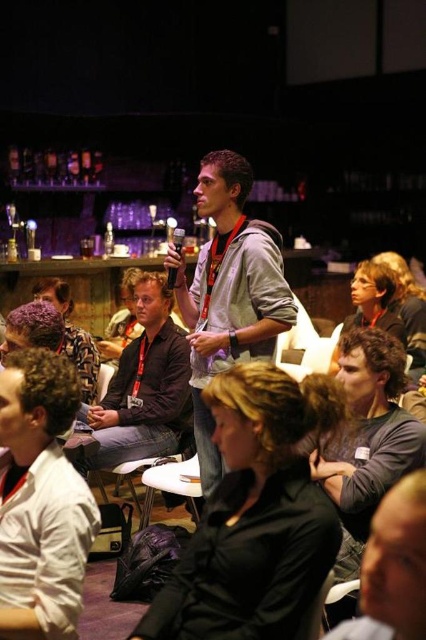
You are a photographer trying to capture a clear shot of both dark brown hair at lower left and dark brown hair at center during the presentation. Which hair should you focus on first to ensure it is in frame?

The dark brown hair at lower left is larger in size than dark brown hair at center, so you should focus on the dark brown hair at lower left first to ensure it is in frame.

You are a photographer positioned at the back of the room. You need to take a photo of both the white cotton shirt at lower left and the dark gray hoodie at center. Which person should you focus on first to ensure both are in the frame?

You should focus on the white cotton shirt at lower left first because it is closer to you than the dark gray hoodie at center, ensuring both are in the frame.

You are a photographer positioned at the back of the conference room. You need to take a photo of both dark brown hair at lower left and dark brown hair at center. Which of the two dark brown hair individuals is more likely to be obscured by others in the photo?

The dark brown hair at lower left is more likely to be obscured because it has a lesser height compared to dark brown hair at center.